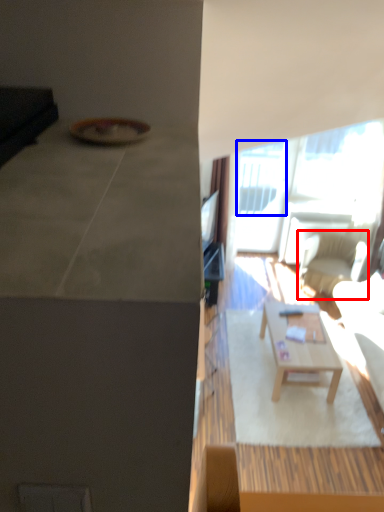
Question: Which of the following is the farthest to the observer, chair (highlighted by a red box) or window (highlighted by a blue box)?

Choices:
 (A) chair
 (B) window

Answer: (B)